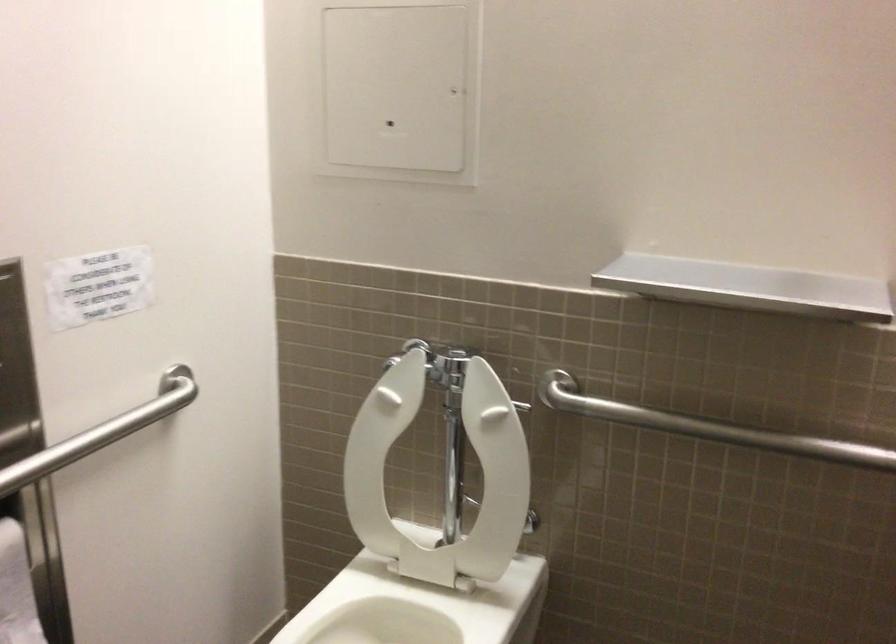
Where is `white toilet seat`? This screenshot has width=896, height=644. white toilet seat is located at coordinates (440, 474).